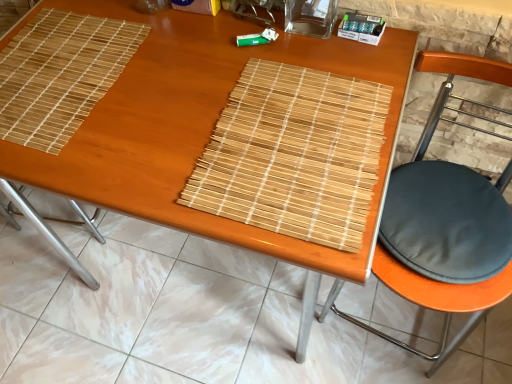
This screenshot has height=384, width=512. Identify the location of black fabric cushion at right. (437, 299).

You are a GUI agent. You are given a task and a screenshot of the screen. Output one action in this format:
    pyautogui.click(x=<x>, y=<y>)
    Task: Click on the black fabric cushion at right
    Image resolution: width=512 pixels, height=384 pixels.
    Given the screenshot: What is the action you would take?
    pyautogui.click(x=437, y=299)

Looking at this image, in terms of height, does natural wood mat at upper left, positioned as the second mat in right-to-left order, look taller or shorter compared to black fabric cushion at right?

In the image, natural wood mat at upper left, positioned as the second mat in right-to-left order, appears to be shorter than black fabric cushion at right.

At what (x,y) coordinates should I click in order to perform the action: click on mat that is the 2nd one when counting backward from the black fabric cushion at right. Please return your answer as a coordinate pair (x, y). The height and width of the screenshot is (384, 512). Looking at the image, I should click on (60, 74).

From the image's perspective, which object appears higher, natural wood mat at upper left, which is counted as the 1th mat, starting from the left, or black fabric cushion at right?

natural wood mat at upper left, which is counted as the 1th mat, starting from the left, appears higher in the image.

Considering the relative sizes of natural wood mat at upper left, positioned as the second mat in right-to-left order, and black fabric cushion at right in the image provided, is natural wood mat at upper left, positioned as the second mat in right-to-left order, bigger than black fabric cushion at right?

Incorrect, natural wood mat at upper left, positioned as the second mat in right-to-left order, is not larger than black fabric cushion at right.

Is natural wood mat at upper left, positioned as the second mat in right-to-left order, facing away from bamboo placemat at center?

No.

Is natural wood mat at upper left, which is counted as the 1th mat, starting from the left, at the left side of bamboo placemat at center?

Indeed, natural wood mat at upper left, which is counted as the 1th mat, starting from the left, is positioned on the left side of bamboo placemat at center.

Does natural wood mat at upper left, which is counted as the 1th mat, starting from the left, have a smaller size compared to bamboo placemat at center?

Yes.

Between natural wood mat at upper left, positioned as the second mat in right-to-left order, and bamboo placemat at center, which one has smaller width?

natural wood mat at upper left, positioned as the second mat in right-to-left order.

Is black fabric cushion at right spatially inside natural wood mat at upper left, positioned as the second mat in right-to-left order, or outside of it?

black fabric cushion at right is not inside natural wood mat at upper left, positioned as the second mat in right-to-left order, it's outside.

Which is more to the right, black fabric cushion at right or natural wood mat at upper left, which is counted as the 1th mat, starting from the left?

Positioned to the right is black fabric cushion at right.

Is black fabric cushion at right thinner than natural wood mat at upper left, which is counted as the 1th mat, starting from the left?

In fact, black fabric cushion at right might be wider than natural wood mat at upper left, which is counted as the 1th mat, starting from the left.

Can you tell me how much black fabric cushion at right and natural wood mat at upper left, positioned as the second mat in right-to-left order, differ in facing direction?

The angular difference between black fabric cushion at right and natural wood mat at upper left, positioned as the second mat in right-to-left order, is 93.8 degrees.

Is natural bamboo mat at center, positioned as the second mat in left-to-right order, positioned behind black fabric cushion at right?

Yes.

Can you confirm if natural bamboo mat at center, which ranks as the first mat in right-to-left order, is wider than black fabric cushion at right?

Incorrect, the width of natural bamboo mat at center, which ranks as the first mat in right-to-left order, does not surpass that of black fabric cushion at right.

Which object is positioned more to the left, natural bamboo mat at center, positioned as the second mat in left-to-right order, or black fabric cushion at right?

natural bamboo mat at center, positioned as the second mat in left-to-right order.

Can you tell me how much natural bamboo mat at center, positioned as the second mat in left-to-right order, and black fabric cushion at right differ in facing direction?

86.2 degrees.

Considering the sizes of bamboo placemat at center and natural wood mat at upper left, which is counted as the 1th mat, starting from the left, in the image, is bamboo placemat at center taller or shorter than natural wood mat at upper left, which is counted as the 1th mat, starting from the left,?

bamboo placemat at center is taller than natural wood mat at upper left, which is counted as the 1th mat, starting from the left.

Considering the positions of objects bamboo placemat at center and natural wood mat at upper left, which is counted as the 1th mat, starting from the left, in the image provided, who is more to the left, bamboo placemat at center or natural wood mat at upper left, which is counted as the 1th mat, starting from the left,?

natural wood mat at upper left, which is counted as the 1th mat, starting from the left.

In the scene shown: Which of these two, bamboo placemat at center or natural wood mat at upper left, which is counted as the 1th mat, starting from the left, is smaller?

Smaller between the two is natural wood mat at upper left, which is counted as the 1th mat, starting from the left.

Which is farther, (159, 250) or (78, 38)?

Point (159, 250)

Does natural bamboo mat at center, which ranks as the first mat in right-to-left order, appear on the left side of bamboo placemat at center?

No.

At what (x,y) coordinates should I click in order to perform the action: click on mat located on the right of bamboo placemat at center. Please return your answer as a coordinate pair (x, y). Looking at the image, I should click on [x=294, y=154].

From a real-world perspective, is natural bamboo mat at center, which ranks as the first mat in right-to-left order, on bamboo placemat at center?

Indeed, from a real-world perspective, natural bamboo mat at center, which ranks as the first mat in right-to-left order, stands above bamboo placemat at center.

Which object is wider, bamboo placemat at center or natural bamboo mat at center, which ranks as the first mat in right-to-left order?

With larger width is bamboo placemat at center.

What's the angular difference between bamboo placemat at center and natural bamboo mat at center, positioned as the second mat in left-to-right order,'s facing directions?

0.289 degrees separate the facing orientations of bamboo placemat at center and natural bamboo mat at center, positioned as the second mat in left-to-right order.

From a real-world perspective, does bamboo placemat at center sit lower than natural bamboo mat at center, which ranks as the first mat in right-to-left order?

Yes.

Image resolution: width=512 pixels, height=384 pixels. I want to click on the 2nd mat above when counting from the black fabric cushion at right (from the image's perspective), so click(60, 74).

I want to click on mat on the left of bamboo placemat at center, so click(x=60, y=74).

From the image, which object appears to be farther from bamboo placemat at center, natural bamboo mat at center, which ranks as the first mat in right-to-left order, or black fabric cushion at right?

natural bamboo mat at center, which ranks as the first mat in right-to-left order, is positioned further to the anchor bamboo placemat at center.

Considering their positions, is bamboo placemat at center positioned closer to natural wood mat at upper left, positioned as the second mat in right-to-left order, than black fabric cushion at right?

Based on the image, black fabric cushion at right appears to be nearer to natural wood mat at upper left, positioned as the second mat in right-to-left order.

When comparing their distances from black fabric cushion at right, does bamboo placemat at center or natural wood mat at upper left, positioned as the second mat in right-to-left order, seem further?

bamboo placemat at center lies further to black fabric cushion at right than the other object.

Estimate the real-world distances between objects in this image. Which object is further from black fabric cushion at right, natural bamboo mat at center, which ranks as the first mat in right-to-left order, or bamboo placemat at center?

bamboo placemat at center is positioned further to the anchor black fabric cushion at right.

Looking at this image, when comparing their distances from natural wood mat at upper left, positioned as the second mat in right-to-left order, does black fabric cushion at right or bamboo placemat at center seem further?

The object further to natural wood mat at upper left, positioned as the second mat in right-to-left order, is bamboo placemat at center.

Which object lies nearer to the anchor point bamboo placemat at center, natural wood mat at upper left, positioned as the second mat in right-to-left order, or natural bamboo mat at center, which ranks as the first mat in right-to-left order?

Based on the image, natural wood mat at upper left, positioned as the second mat in right-to-left order, appears to be nearer to bamboo placemat at center.

Estimate the real-world distances between objects in this image. Which object is further from natural wood mat at upper left, which is counted as the 1th mat, starting from the left, bamboo placemat at center or natural bamboo mat at center, positioned as the second mat in left-to-right order?

bamboo placemat at center is positioned further to the anchor natural wood mat at upper left, which is counted as the 1th mat, starting from the left.

Estimate the real-world distances between objects in this image. Which object is closer to natural bamboo mat at center, which ranks as the first mat in right-to-left order, black fabric cushion at right or bamboo placemat at center?

black fabric cushion at right is positioned closer to the anchor natural bamboo mat at center, which ranks as the first mat in right-to-left order.

Identify the location of tile between natural wood mat at upper left, which is counted as the 1th mat, starting from the left, and black fabric cushion at right from left to right. (193, 317).

Locate an element on the screen. This screenshot has height=384, width=512. mat between natural wood mat at upper left, positioned as the second mat in right-to-left order, and black fabric cushion at right from left to right is located at coordinates (294, 154).

Where is `mat between natural wood mat at upper left, which is counted as the 1th mat, starting from the left, and bamboo placemat at center from top to bottom`? Image resolution: width=512 pixels, height=384 pixels. mat between natural wood mat at upper left, which is counted as the 1th mat, starting from the left, and bamboo placemat at center from top to bottom is located at coordinates (294, 154).

Identify the location of mat between bamboo placemat at center and black fabric cushion at right in the horizontal direction. (294, 154).